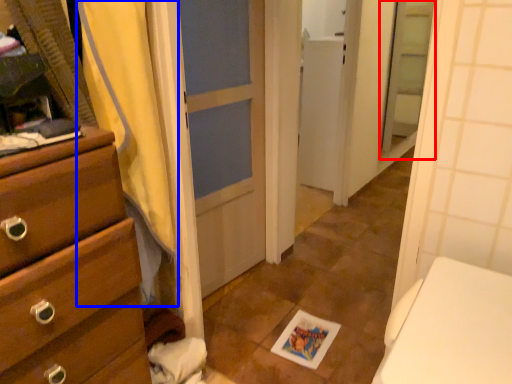
Question: Which point is further to the camera, screen door (highlighted by a red box) or shower curtain (highlighted by a blue box)?

Choices:
 (A) screen door
 (B) shower curtain

Answer: (A)